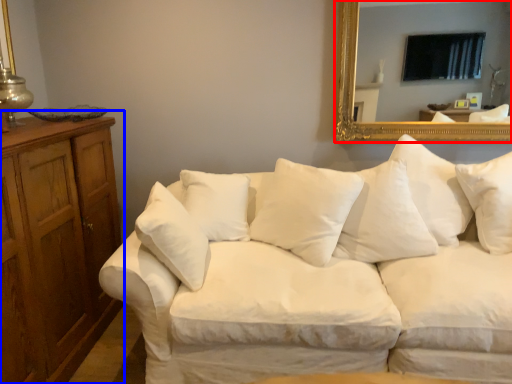
Question: Among these objects, which one is farthest to the camera, mirror (highlighted by a red box) or dresser (highlighted by a blue box)?

Choices:
 (A) mirror
 (B) dresser

Answer: (A)